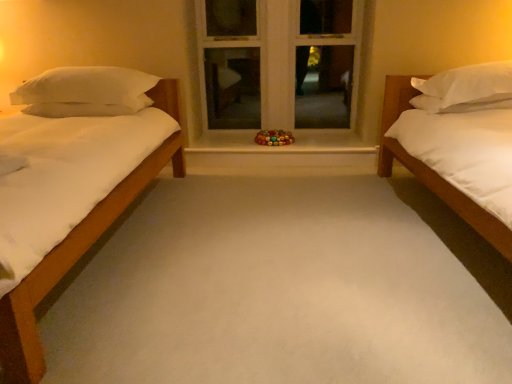
Question: From the image's perspective, is white soft pillow at left, which ranks as the 2th pillow in right-to-left order, under white matte bed at right?

Choices:
 (A) no
 (B) yes

Answer: (A)

Question: From a real-world perspective, is white soft pillow at left, which ranks as the 2th pillow in right-to-left order, beneath white matte bed at right?

Choices:
 (A) no
 (B) yes

Answer: (A)

Question: Can you confirm if white soft pillow at left, which ranks as the 2th pillow in right-to-left order, is positioned to the right of white matte bed at right?

Choices:
 (A) yes
 (B) no

Answer: (B)

Question: Is the position of white soft pillow at left, arranged as the 1th pillow when viewed from the left, more distant than that of white matte bed at right?

Choices:
 (A) no
 (B) yes

Answer: (B)

Question: Can you confirm if white soft pillow at left, which ranks as the 2th pillow in right-to-left order, is taller than white matte bed at right?

Choices:
 (A) yes
 (B) no

Answer: (B)

Question: From a real-world perspective, is white painted wood at center positioned above or below white matte bed at right?

Choices:
 (A) above
 (B) below

Answer: (A)

Question: Is point (309, 0) closer or farther from the camera than point (387, 92)?

Choices:
 (A) closer
 (B) farther

Answer: (B)

Question: Is white painted wood at center bigger or smaller than white matte bed at right?

Choices:
 (A) big
 (B) small

Answer: (B)

Question: From their relative heights in the image, would you say white painted wood at center is taller or shorter than white matte bed at right?

Choices:
 (A) short
 (B) tall

Answer: (B)

Question: In the image, is white painted wood at center positioned in front of or behind white marble window sill at center?

Choices:
 (A) behind
 (B) front

Answer: (A)

Question: From a real-world perspective, is white painted wood at center above or below white marble window sill at center?

Choices:
 (A) below
 (B) above

Answer: (B)

Question: Based on their sizes in the image, would you say white painted wood at center is bigger or smaller than white marble window sill at center?

Choices:
 (A) small
 (B) big

Answer: (B)

Question: From the image's perspective, relative to white marble window sill at center, is white painted wood at center above or below?

Choices:
 (A) above
 (B) below

Answer: (A)

Question: Relative to white soft pillow at left, which ranks as the 2th pillow in right-to-left order, is white marble window sill at center in front or behind?

Choices:
 (A) behind
 (B) front

Answer: (A)

Question: Is point (339, 135) positioned closer to the camera than point (93, 72)?

Choices:
 (A) farther
 (B) closer

Answer: (A)